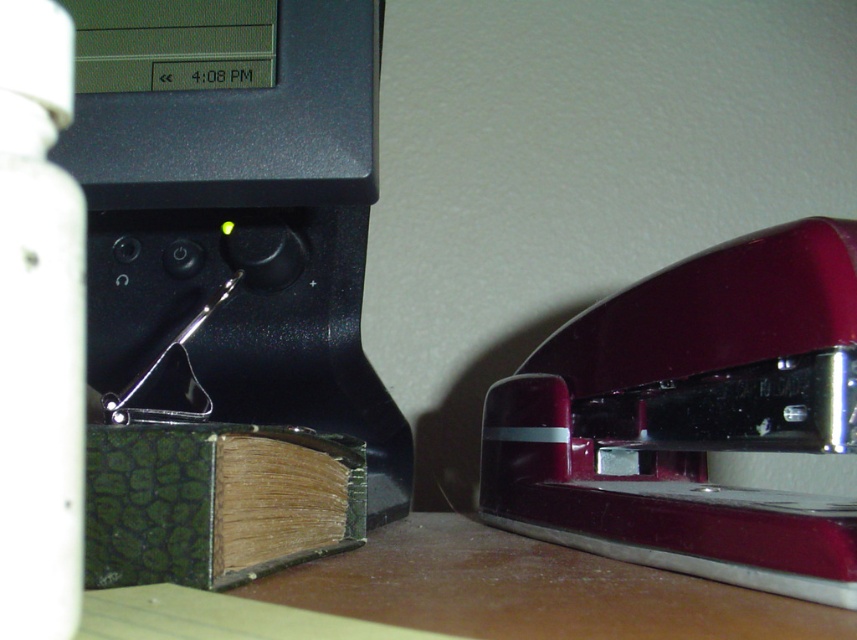
Does glossy maroon stapler at lower right have a larger size compared to white matte bottle at left?

Indeed, glossy maroon stapler at lower right has a larger size compared to white matte bottle at left.

Between glossy maroon stapler at lower right and white matte bottle at left, which one has less height?

With less height is white matte bottle at left.

Who is more distant from viewer, [499,388] or [76,253]?

The point [499,388] is more distant.

Locate an element on the screen. This screenshot has height=640, width=857. glossy maroon stapler at lower right is located at coordinates (692, 417).

Is white matte bottle at left shorter than green textured book at lower left?

No.

Who is higher up, white matte bottle at left or green textured book at lower left?

white matte bottle at left

The height and width of the screenshot is (640, 857). Describe the element at coordinates (39, 330) in the screenshot. I see `white matte bottle at left` at that location.

Image resolution: width=857 pixels, height=640 pixels. Identify the location of white matte bottle at left. pos(39,330).

Is glossy maroon stapler at lower right wider than green textured book at lower left?

Correct, the width of glossy maroon stapler at lower right exceeds that of green textured book at lower left.

Does point (723, 541) come in front of point (285, 563)?

That is True.

Locate an element on the screen. The image size is (857, 640). glossy maroon stapler at lower right is located at coordinates (692, 417).